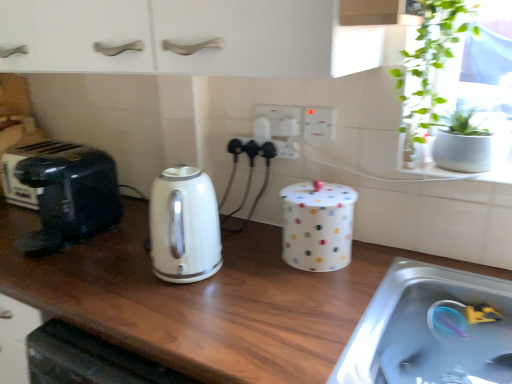
You are a GUI agent. You are given a task and a screenshot of the screen. Output one action in this format:
    pyautogui.click(x=<x>, y=<y>)
    Task: Click on the free space above black plastic toaster at left, which is counted as the first appliance, starting from the left (from a real-world perspective)
    This screenshot has width=512, height=384.
    Given the screenshot: What is the action you would take?
    pyautogui.click(x=40, y=146)